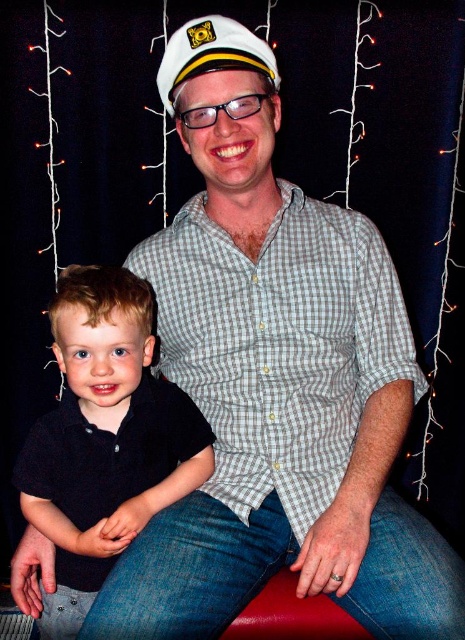
Between point (143, 296) and point (221, 44), which one is positioned behind?

The point (143, 296) is behind.

Does black cotton shirt at lower left have a lesser width compared to white matte sailor hat at upper center?

In fact, black cotton shirt at lower left might be wider than white matte sailor hat at upper center.

Find the location of a particular element. The width and height of the screenshot is (465, 640). black cotton shirt at lower left is located at coordinates coord(105,438).

Find the location of a particular element. The image size is (465, 640). black cotton shirt at lower left is located at coordinates (105, 438).